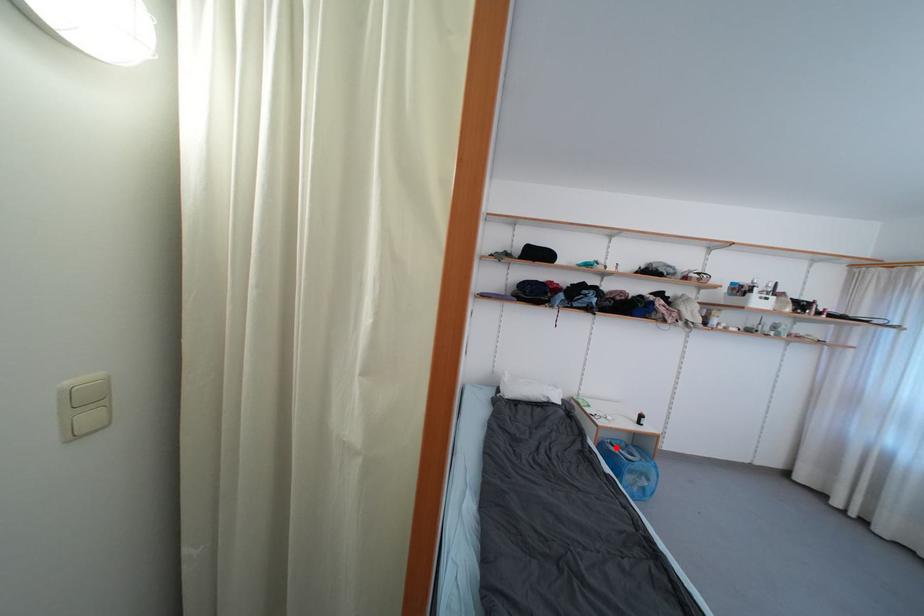
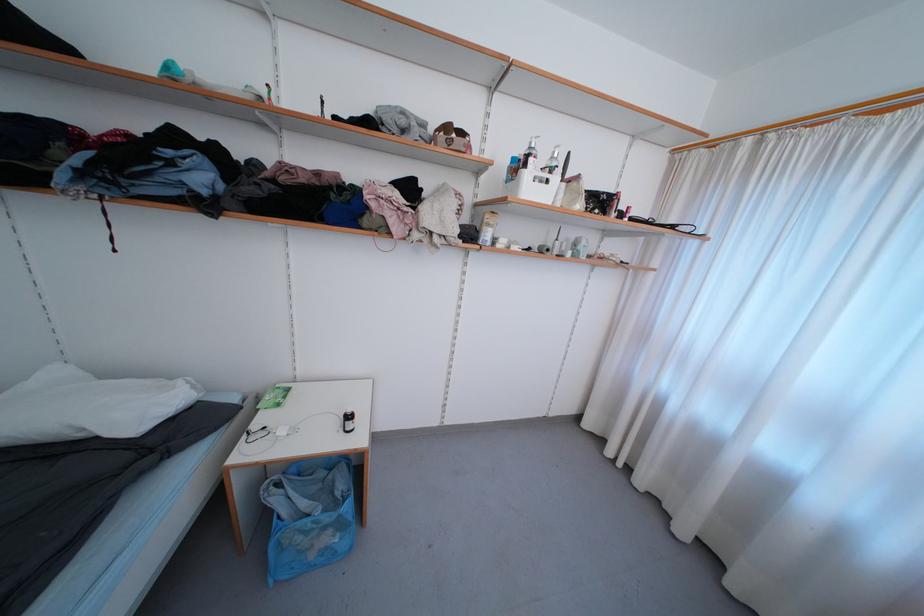
Question: I am providing you with two images of the same scene from different viewpoints. A red point is shown in image1. For the corresponding object point in image2, is it positioned nearer or farther from the camera?

Choices:
 (A) Nearer
 (B) Farther

Answer: (A)